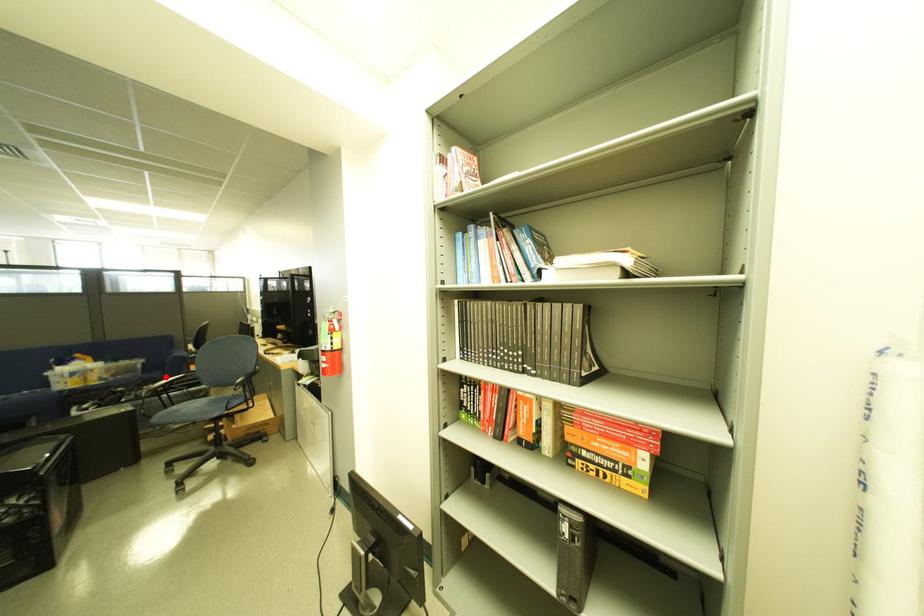
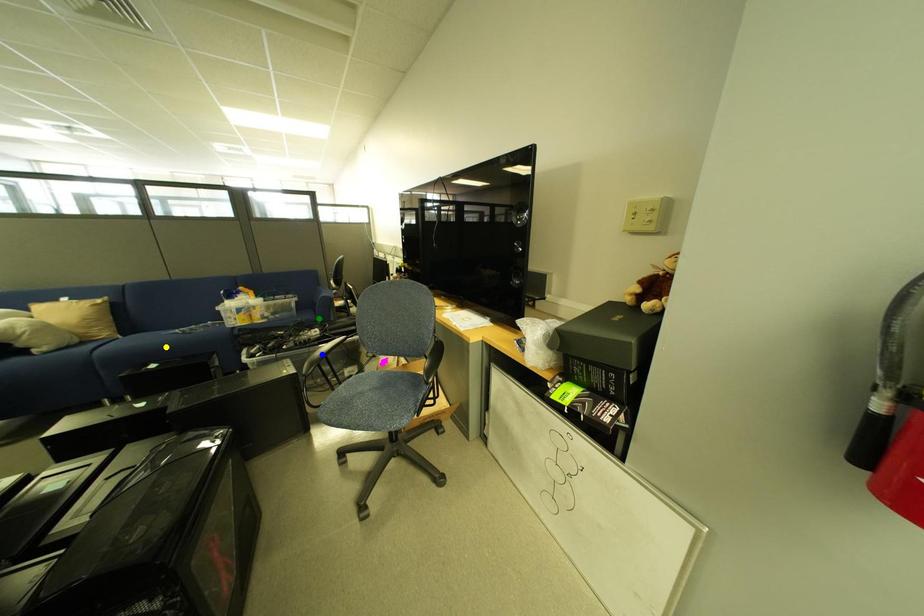
Question: I am providing you with two images of the same scene from different viewpoints. A red point is marked on the first image. You are given multiple points on the second image. Which mark in image 2 goes with the point in image 1?

Choices:
 (A) green point
 (B) blue point
 (C) yellow point

Answer: (A)